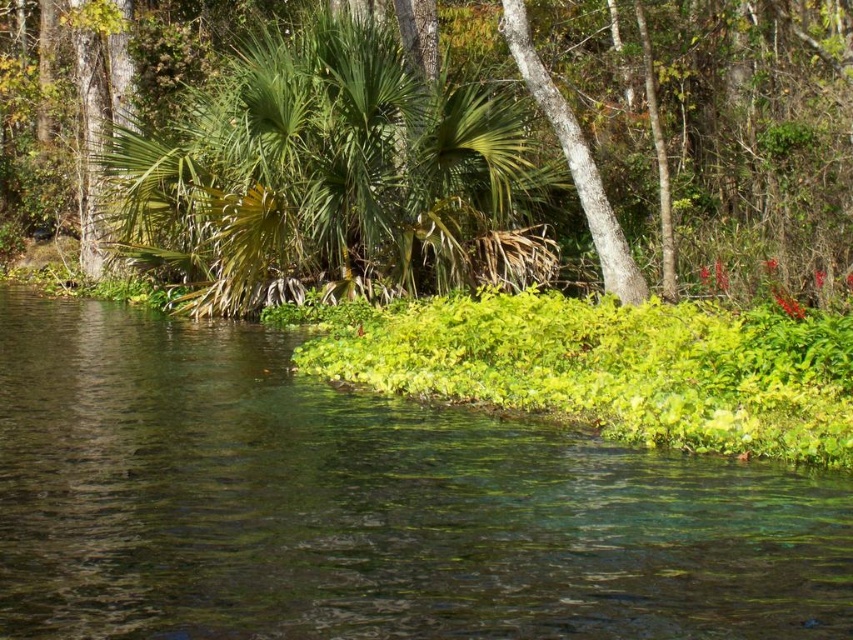
From the picture: Can you confirm if green leafy vegetation at lower center is positioned to the right of green leafy tree at center?

Yes, green leafy vegetation at lower center is to the right of green leafy tree at center.

Describe the element at coordinates (364, 506) in the screenshot. I see `green leafy vegetation at lower center` at that location.

Is point (82, 371) in front of point (492, 56)?

Yes, point (82, 371) is in front of point (492, 56).

I want to click on green leafy vegetation at lower center, so click(x=364, y=506).